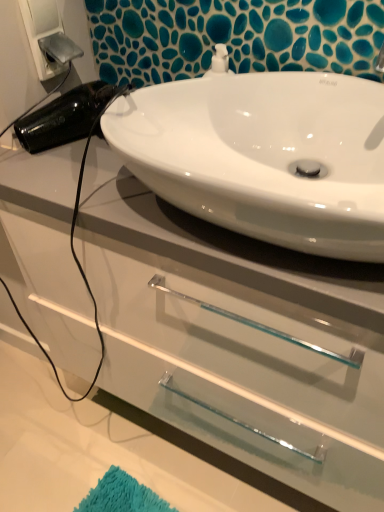
Where is `white glossy cabinet at center`? white glossy cabinet at center is located at coordinates (237, 341).

Considering the positions of objects white plastic electric outlet at upper left and white glossy sink at upper center in the image provided, who is behind, white plastic electric outlet at upper left or white glossy sink at upper center?

white plastic electric outlet at upper left is further from the camera.

Which is more to the left, white plastic electric outlet at upper left or white glossy sink at upper center?

Positioned to the left is white plastic electric outlet at upper left.

Locate an element on the screen. electric outlet above the white glossy sink at upper center (from a real-world perspective) is located at coordinates (42, 33).

Which of these two, white plastic electric outlet at upper left or white glossy sink at upper center, is thinner?

white plastic electric outlet at upper left.

Does point (35, 10) come farther from viewer compared to point (54, 349)?

No, it is in front of (54, 349).

Considering their positions, is white plastic electric outlet at upper left located in front of or behind white glossy cabinet at center?

white plastic electric outlet at upper left is behind white glossy cabinet at center.

Measure the distance from white plastic electric outlet at upper left to white glossy cabinet at center.

white plastic electric outlet at upper left and white glossy cabinet at center are 57.72 centimeters apart from each other.

Looking at their sizes, would you say white plastic electric outlet at upper left is wider or thinner than white glossy cabinet at center?

white plastic electric outlet at upper left is thinner than white glossy cabinet at center.

Visually, is white glossy cabinet at center positioned to the left or to the right of white plastic electric outlet at upper left?

From the image, it's evident that white glossy cabinet at center is to the right of white plastic electric outlet at upper left.

The width and height of the screenshot is (384, 512). I want to click on electric outlet to the left of white glossy cabinet at center, so click(x=42, y=33).

From the image's perspective, which object appears higher, white glossy cabinet at center or white plastic electric outlet at upper left?

white plastic electric outlet at upper left is shown above in the image.

In the scene shown: Based on their sizes in the image, would you say white glossy sink at upper center is bigger or smaller than white plastic electric outlet at upper left?

In the image, white glossy sink at upper center appears to be larger than white plastic electric outlet at upper left.

Is white glossy sink at upper center aimed at white plastic electric outlet at upper left?

No, white glossy sink at upper center is not oriented towards white plastic electric outlet at upper left.

Is point (243, 224) closer or farther from the camera than point (50, 77)?

Point (243, 224) is positioned closer to the camera compared to point (50, 77).

Is the depth of white glossy sink at upper center greater than that of white plastic electric outlet at upper left?

No.

Is white glossy cabinet at center in contact with white glossy sink at upper center?

They are not placed beside each other.

Is white glossy cabinet at center taller or shorter than white glossy sink at upper center?

Clearly, white glossy cabinet at center is taller compared to white glossy sink at upper center.

Considering the sizes of objects white glossy cabinet at center and white glossy sink at upper center in the image provided, who is bigger, white glossy cabinet at center or white glossy sink at upper center?

With larger size is white glossy cabinet at center.

Is white glossy cabinet at center oriented towards white glossy sink at upper center?

No, white glossy cabinet at center is not turned towards white glossy sink at upper center.

Are white glossy sink at upper center and white glossy cabinet at center far apart?

No, white glossy sink at upper center is in close proximity to white glossy cabinet at center.

Is white glossy sink at upper center shorter than white glossy cabinet at center?

Yes, white glossy sink at upper center is shorter than white glossy cabinet at center.

Is point (217, 91) farther from viewer compared to point (135, 357)?

No, it is in front of (135, 357).

In the image, is white glossy sink at upper center positioned in front of or behind white glossy cabinet at center?

In the image, white glossy sink at upper center appears in front of white glossy cabinet at center.

Identify the location of electric outlet located behind the white glossy sink at upper center. This screenshot has width=384, height=512. (42, 33).

At what (x,y) coordinates should I click in order to perform the action: click on bathroom cabinet in front of the white plastic electric outlet at upper left. Please return your answer as a coordinate pair (x, y). This screenshot has height=512, width=384. Looking at the image, I should click on (237, 341).

When comparing their distances from white plastic electric outlet at upper left, does white glossy cabinet at center or white glossy sink at upper center seem further?

Among the two, white glossy cabinet at center is located further to white plastic electric outlet at upper left.

Estimate the real-world distances between objects in this image. Which object is closer to white glossy cabinet at center, white plastic electric outlet at upper left or white glossy sink at upper center?

Among the two, white glossy sink at upper center is located nearer to white glossy cabinet at center.

Which object lies nearer to the anchor point white glossy sink at upper center, white plastic electric outlet at upper left or white glossy cabinet at center?

The object closer to white glossy sink at upper center is white glossy cabinet at center.

Estimate the real-world distances between objects in this image. Which object is closer to white glossy sink at upper center, white glossy cabinet at center or white plastic electric outlet at upper left?

The object closer to white glossy sink at upper center is white glossy cabinet at center.

Estimate the real-world distances between objects in this image. Which object is further from white plastic electric outlet at upper left, white glossy sink at upper center or white glossy cabinet at center?

white glossy cabinet at center is positioned further to the anchor white plastic electric outlet at upper left.

Considering their positions, is white glossy sink at upper center positioned closer to white glossy cabinet at center than white plastic electric outlet at upper left?

Based on the image, white glossy sink at upper center appears to be nearer to white glossy cabinet at center.

Locate an element on the screen. The height and width of the screenshot is (512, 384). sink between white plastic electric outlet at upper left and white glossy cabinet at center in the vertical direction is located at coordinates (264, 155).